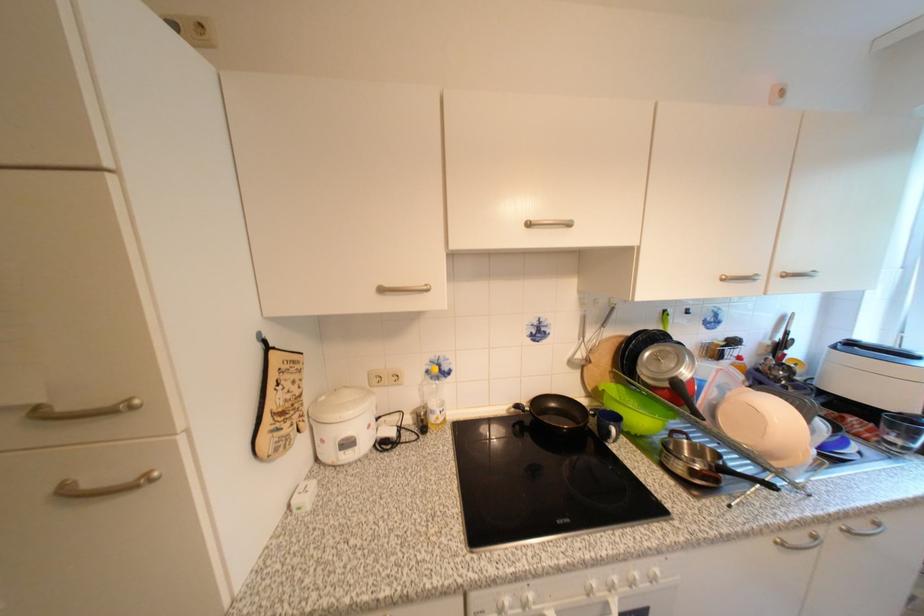
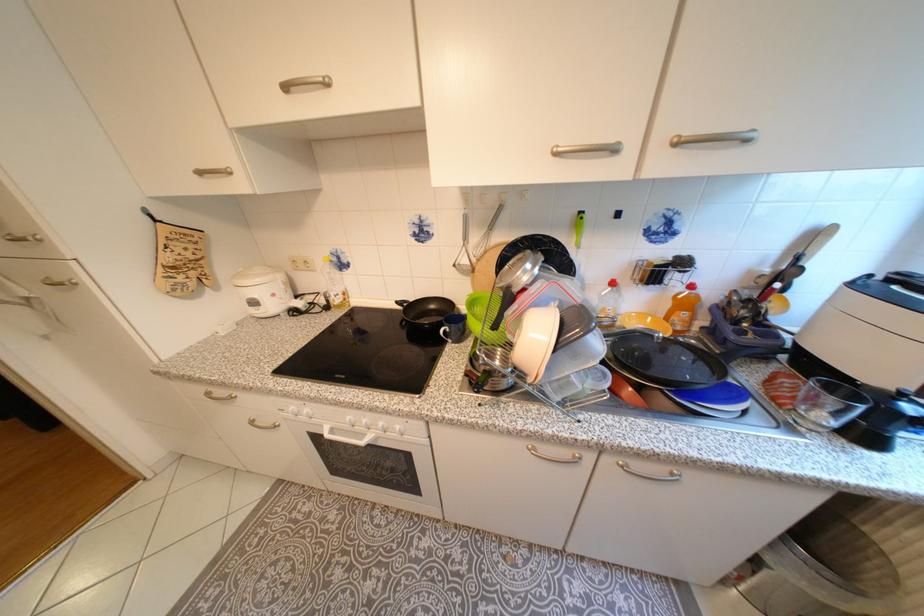
Where in the second image is the point corresponding to (357,445) from the first image?

(263, 304)